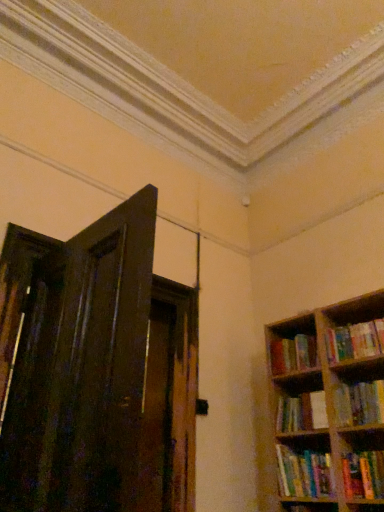
The height and width of the screenshot is (512, 384). Describe the element at coordinates (355, 341) in the screenshot. I see `hardcover books at right, the fifth book in the bottom-to-top sequence` at that location.

Identify the location of hardcover books at right, the fifth book in the bottom-to-top sequence. (355, 341).

At what (x,y) coordinates should I click in order to perform the action: click on multicolored paperbacks at right, the 4th book from the bottom. Please return your answer as a coordinate pair (x, y). The image size is (384, 512). Looking at the image, I should click on (293, 354).

The image size is (384, 512). What do you see at coordinates (305, 473) in the screenshot? I see `hardcover book at right, which is the fifth book from top to bottom` at bounding box center [305, 473].

Find the location of a particular element. This screenshot has height=512, width=384. dark wood door at left is located at coordinates (75, 361).

The image size is (384, 512). What do you see at coordinates (302, 412) in the screenshot? I see `hardcover book at right, which is the fourth book in top-to-bottom order` at bounding box center [302, 412].

Identify the location of hardcover book at right, which is the fourth book in top-to-bottom order. (302, 412).

This screenshot has height=512, width=384. What do you see at coordinates (359, 403) in the screenshot?
I see `hardcover book at right, placed as the third book when sorted from top to bottom` at bounding box center [359, 403].

Identify the location of hardcover book at right, placed as the third book when sorted from top to bottom. The image size is (384, 512). (359, 403).

Find the location of a particular element. The width and height of the screenshot is (384, 512). hardcover books at right, the fifth book in the bottom-to-top sequence is located at coordinates (355, 341).

Is point (354, 330) positioned after point (382, 421)?

Yes, point (354, 330) is behind point (382, 421).

Are hardcover books at right, which is the 1th book from top to bottom, and hardcover book at right, marked as the third book in a bottom-to-top arrangement, beside each other?

They are not placed beside each other.

Is hardcover books at right, the fifth book in the bottom-to-top sequence, spatially inside hardcover book at right, placed as the third book when sorted from top to bottom, or outside of it?

hardcover books at right, the fifth book in the bottom-to-top sequence, is not inside hardcover book at right, placed as the third book when sorted from top to bottom, it's outside.

Which is more to the left, hardcover book at right, placed as the third book when sorted from top to bottom, or dark wood door at left?

dark wood door at left is more to the left.

From a real-world perspective, which object rests below the other?

In real-world perspective, hardcover book at right, placed as the third book when sorted from top to bottom, is lower.

This screenshot has height=512, width=384. Find the location of `book that is the 2nd object directly below the dark wood door at left (from a real-world perspective)`. book that is the 2nd object directly below the dark wood door at left (from a real-world perspective) is located at coordinates (359, 403).

Is dark wood door at left located within hardcover book at right, placed as the third book when sorted from top to bottom?

No, dark wood door at left is located outside of hardcover book at right, placed as the third book when sorted from top to bottom.

Based on their positions, is dark wood door at left located to the left or right of hardcover book at right, placed as the third book when sorted from top to bottom?

Based on their positions, dark wood door at left is located to the left of hardcover book at right, placed as the third book when sorted from top to bottom.

Is dark wood door at left in front of or behind hardcover book at right, placed as the third book when sorted from top to bottom, in the image?

In the image, dark wood door at left appears in front of hardcover book at right, placed as the third book when sorted from top to bottom.

Is dark wood door at left not near hardcover book at right, placed as the third book when sorted from top to bottom?

dark wood door at left is far away from hardcover book at right, placed as the third book when sorted from top to bottom.

From a real-world perspective, is dark wood door at left positioned above or below hardcover book at right, marked as the third book in a bottom-to-top arrangement?

dark wood door at left is above hardcover book at right, marked as the third book in a bottom-to-top arrangement.

Is hardcover book at right, which is the fifth book from top to bottom, not close to hardcover book at right, marked as the third book in a bottom-to-top arrangement?

No, hardcover book at right, which is the fifth book from top to bottom, is not far from hardcover book at right, marked as the third book in a bottom-to-top arrangement.

Can you tell me how much hardcover book at right, which is the fifth book from top to bottom, and hardcover book at right, marked as the third book in a bottom-to-top arrangement, differ in facing direction?

There is a 0.000241-degree angle between the facing directions of hardcover book at right, which is the fifth book from top to bottom, and hardcover book at right, marked as the third book in a bottom-to-top arrangement.

Is hardcover book at right, which is the fifth book from top to bottom, located outside hardcover book at right, placed as the third book when sorted from top to bottom?

Indeed, hardcover book at right, which is the fifth book from top to bottom, is completely outside hardcover book at right, placed as the third book when sorted from top to bottom.

Between hardcover book at right, which is the fifth book from top to bottom, and hardcover book at right, placed as the third book when sorted from top to bottom, which one appears on the left side from the viewer's perspective?

hardcover book at right, which is the fifth book from top to bottom.

Does multicolored paperbacks at right, the 4th book from the bottom, have a lesser height compared to dark wood door at left?

Yes, multicolored paperbacks at right, the 4th book from the bottom, is shorter than dark wood door at left.

Which object is more forward, multicolored paperbacks at right, acting as the 2th book starting from the top, or dark wood door at left?

Positioned in front is dark wood door at left.

From a real-world perspective, is multicolored paperbacks at right, the 4th book from the bottom, physically located above or below dark wood door at left?

Clearly, from a real-world perspective, multicolored paperbacks at right, the 4th book from the bottom, is above dark wood door at left.

Which object is wider, multicolored paperbacks at right, the 4th book from the bottom, or dark wood door at left?

multicolored paperbacks at right, the 4th book from the bottom, is wider.

Is dark wood door at left facing away from multicolored paperbacks at right, the 4th book from the bottom?

No, dark wood door at left's orientation is not away from multicolored paperbacks at right, the 4th book from the bottom.

From the image's perspective, which is below, dark wood door at left or multicolored paperbacks at right, acting as the 2th book starting from the top?

multicolored paperbacks at right, acting as the 2th book starting from the top, is shown below in the image.

Which object is positioned more to the right, dark wood door at left or multicolored paperbacks at right, the 4th book from the bottom?

multicolored paperbacks at right, the 4th book from the bottom.

This screenshot has height=512, width=384. Find the location of `the 3rd book to the right of the dark wood door at left, counting from the anchor's position`. the 3rd book to the right of the dark wood door at left, counting from the anchor's position is located at coordinates (293, 354).

Is hardcover book at right, which is the fourth book in top-to-bottom order, a part of dark wood door at left?

No, dark wood door at left does not contain hardcover book at right, which is the fourth book in top-to-bottom order.

Does dark wood door at left have a smaller size compared to hardcover book at right, arranged as the second book when ordered from the bottom?

Actually, dark wood door at left might be larger than hardcover book at right, arranged as the second book when ordered from the bottom.

In the scene shown: From the image's perspective, is dark wood door at left on top of hardcover book at right, which is the fourth book in top-to-bottom order?

Yes, from the image's perspective, dark wood door at left is on top of hardcover book at right, which is the fourth book in top-to-bottom order.

Is dark wood door at left turned away from hardcover book at right, arranged as the second book when ordered from the bottom?

No, hardcover book at right, arranged as the second book when ordered from the bottom, is not at the back of dark wood door at left.

The height and width of the screenshot is (512, 384). Find the location of `book on the right of hardcover book at right, marked as the third book in a bottom-to-top arrangement`. book on the right of hardcover book at right, marked as the third book in a bottom-to-top arrangement is located at coordinates (355, 341).

The image size is (384, 512). Find the location of `book that is the 2nd object directly below the dark wood door at left (from a real-world perspective)`. book that is the 2nd object directly below the dark wood door at left (from a real-world perspective) is located at coordinates (359, 403).

Based on their spatial positions, is multicolored paperbacks at right, the 4th book from the bottom, or hardcover book at right, arranged as the second book when ordered from the bottom, further from hardcover book at right, which is the fifth book from top to bottom?

Based on the image, multicolored paperbacks at right, the 4th book from the bottom, appears to be further to hardcover book at right, which is the fifth book from top to bottom.

From the picture: From the image, which object appears to be nearer to multicolored paperbacks at right, acting as the 2th book starting from the top, hardcover books at right, which is the 1th book from top to bottom, or dark wood door at left?

Among the two, hardcover books at right, which is the 1th book from top to bottom, is located nearer to multicolored paperbacks at right, acting as the 2th book starting from the top.

Estimate the real-world distances between objects in this image. Which object is further from hardcover books at right, which is the 1th book from top to bottom, multicolored paperbacks at right, acting as the 2th book starting from the top, or dark wood door at left?

dark wood door at left is further to hardcover books at right, which is the 1th book from top to bottom.

Which object lies further to the anchor point hardcover book at right, arranged as the second book when ordered from the bottom, hardcover book at right, which is the fifth book from top to bottom, or hardcover book at right, placed as the third book when sorted from top to bottom?

Based on the image, hardcover book at right, which is the fifth book from top to bottom, appears to be further to hardcover book at right, arranged as the second book when ordered from the bottom.

Looking at the image, which one is located further to hardcover book at right, marked as the third book in a bottom-to-top arrangement, multicolored paperbacks at right, acting as the 2th book starting from the top, or hardcover book at right, which is the fourth book in top-to-bottom order?

The object further to hardcover book at right, marked as the third book in a bottom-to-top arrangement, is multicolored paperbacks at right, acting as the 2th book starting from the top.

When comparing their distances from hardcover book at right, which is the fifth book from top to bottom, does hardcover books at right, which is the 1th book from top to bottom, or multicolored paperbacks at right, acting as the 2th book starting from the top, seem closer?

multicolored paperbacks at right, acting as the 2th book starting from the top, is positioned closer to the anchor hardcover book at right, which is the fifth book from top to bottom.

Based on their spatial positions, is dark wood door at left or hardcover book at right, marked as the third book in a bottom-to-top arrangement, further from multicolored paperbacks at right, the 4th book from the bottom?

dark wood door at left is positioned further to the anchor multicolored paperbacks at right, the 4th book from the bottom.

When comparing their distances from hardcover book at right, marked as the third book in a bottom-to-top arrangement, does hardcover book at right, which is the fourth book in top-to-bottom order, or multicolored paperbacks at right, the 4th book from the bottom, seem closer?

hardcover book at right, which is the fourth book in top-to-bottom order, is closer to hardcover book at right, marked as the third book in a bottom-to-top arrangement.

Identify the location of book between dark wood door at left and hardcover book at right, which is the fifth book from top to bottom, from left to right. Image resolution: width=384 pixels, height=512 pixels. tap(302, 412).

Find the location of a particular element. book between hardcover book at right, placed as the third book when sorted from top to bottom, and hardcover book at right, arranged as the first book when ordered from the bottom, vertically is located at coordinates (302, 412).